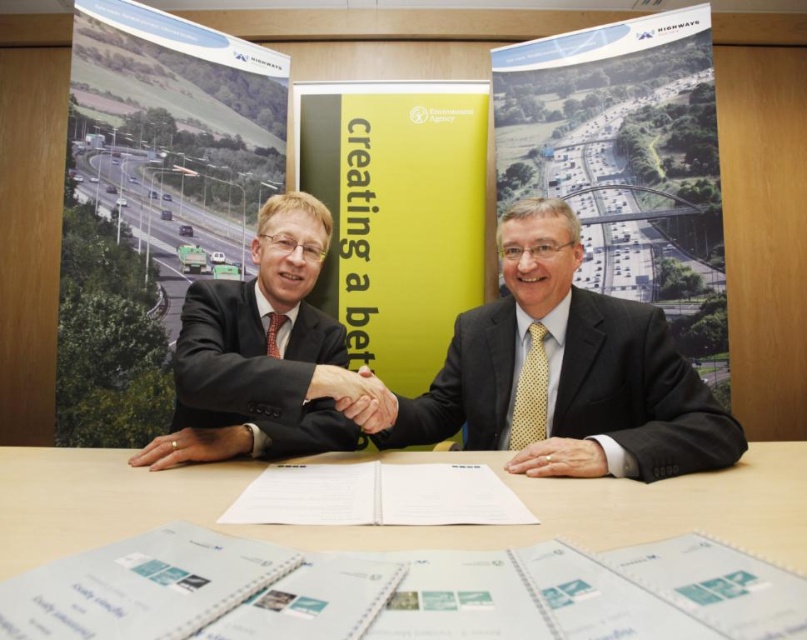
Is yellow matte poster at center closer to the viewer compared to matte black suit at center?

That is False.

Is point (473, 225) more distant than point (176, 394)?

That is True.

Locate an element on the screen. yellow matte poster at center is located at coordinates (396, 216).

Can you confirm if gold metallic ring at center is thinner than smooth skin hand at center?

Incorrect, gold metallic ring at center's width is not less than smooth skin hand at center's.

Who is taller, gold metallic ring at center or smooth skin hand at center?

smooth skin hand at center

Does point (224, 428) come behind point (368, 420)?

Yes, point (224, 428) is behind point (368, 420).

Where is `gold metallic ring at center`? The image size is (807, 640). gold metallic ring at center is located at coordinates (194, 445).

Does yellow matte poster at center have a lesser width compared to gold metallic ring at center?

No.

What do you see at coordinates (396, 216) in the screenshot? I see `yellow matte poster at center` at bounding box center [396, 216].

Is point (400, 362) farther from viewer compared to point (144, 458)?

Yes, point (400, 362) is farther from viewer.

The height and width of the screenshot is (640, 807). I want to click on yellow matte poster at center, so click(396, 216).